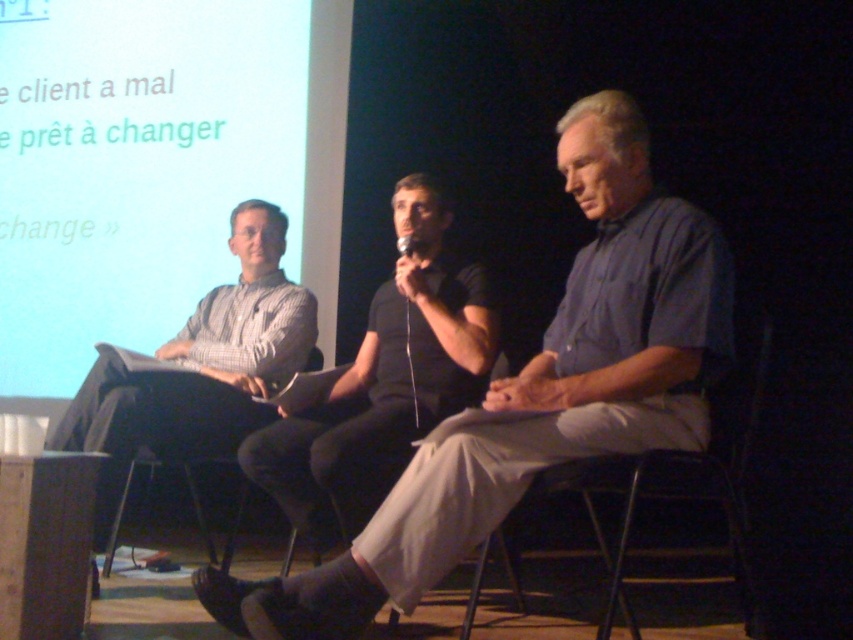
Based on the coordinates provided, which object is located at the point (538, 392)?

The point (538, 392) corresponds to the light blue shirt at center according to the coordinates provided.